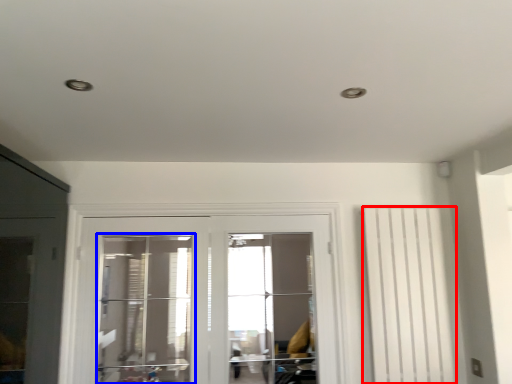
Question: Which object appears farthest to the camera in this image, curtain (highlighted by a red box) or window (highlighted by a blue box)?

Choices:
 (A) curtain
 (B) window

Answer: (A)